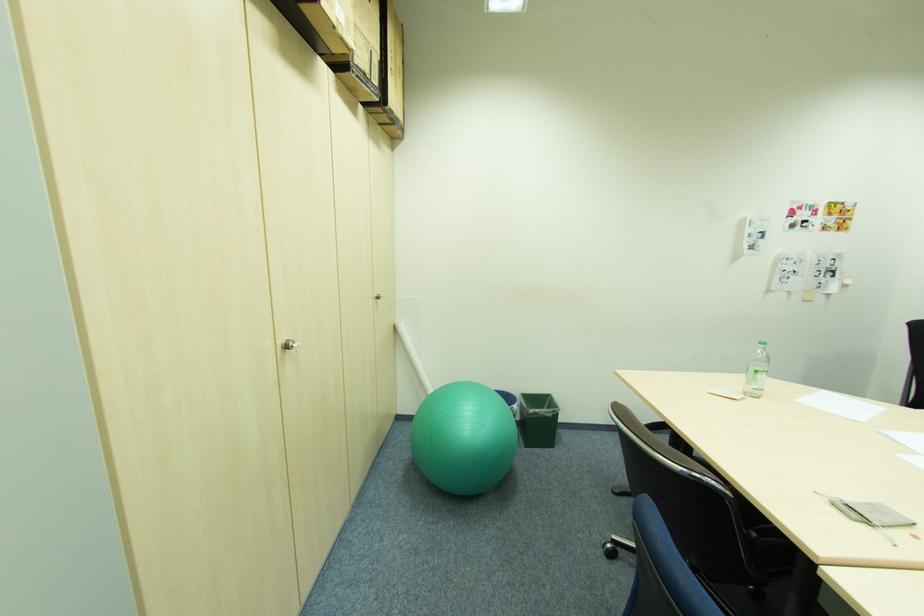
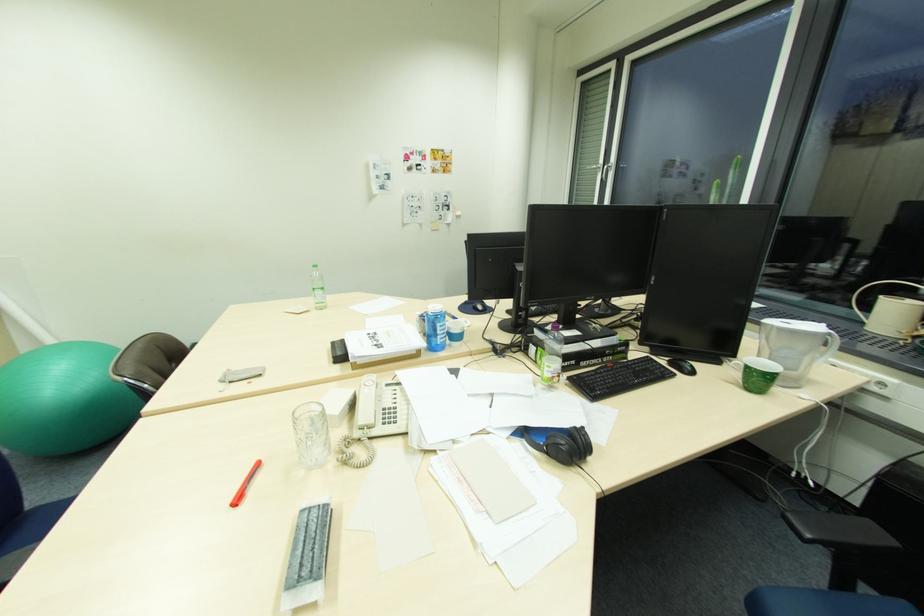
In a continuous first-person perspective shot, in which direction is the camera moving?

The cameraman moved toward right, backward.